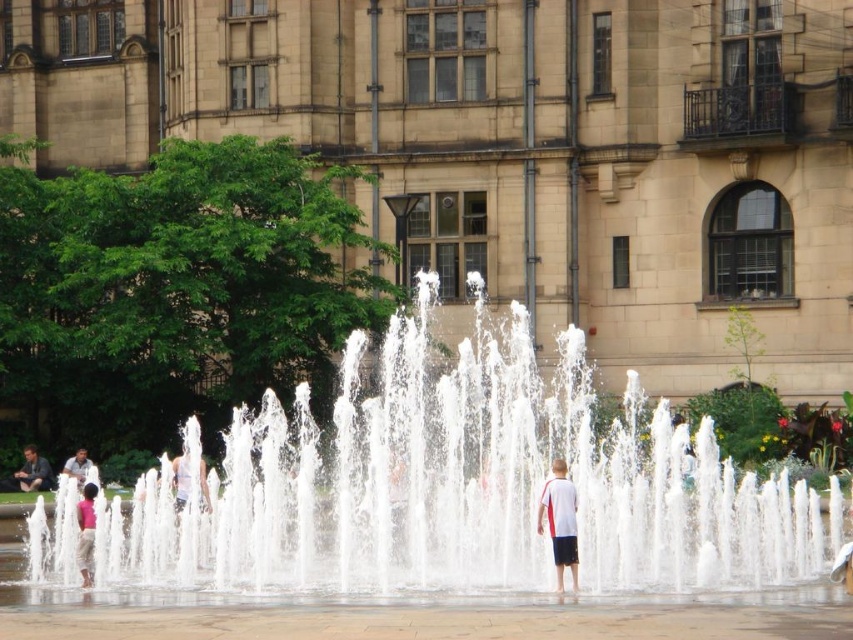
Consider the image. You are standing at the edge of the fountain and see the pink fabric at center and the light blue shirt at center. Which one is closer to the right side of the fountain?

The pink fabric at center is closer to the right side of the fountain because it is positioned to the right of the light blue shirt at center.

You are a photographer trying to capture a photo of the fountain. You notice the white cotton shirt at center and the pink fabric at center in your frame. Which object should you adjust your camera angle to focus on first if you want to prioritize the one closer to the left side?

The pink fabric at center is closer to the left side, so you should adjust your camera angle to focus on the pink fabric at center first.

You are standing at the center of the fountain and want to find the pink fabric at center. According to the coordinates provided, in which direction should you look to locate it?

The pink fabric at center is located at coordinates point (86, 532), so you should look to the right side of the fountain to locate it.